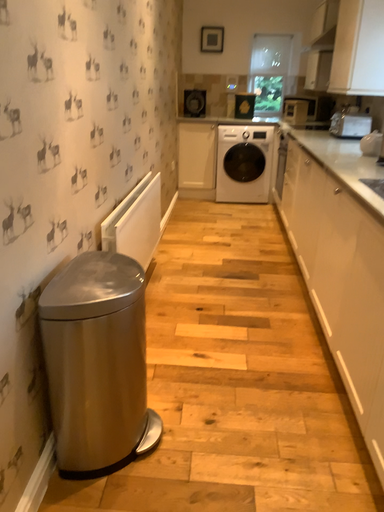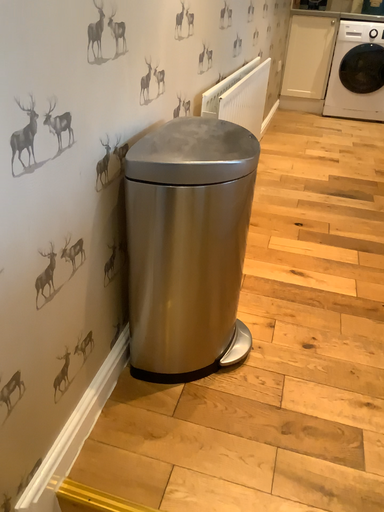
Question: How did the camera likely rotate when shooting the video?

Choices:
 (A) rotated downward
 (B) rotated upward

Answer: (A)